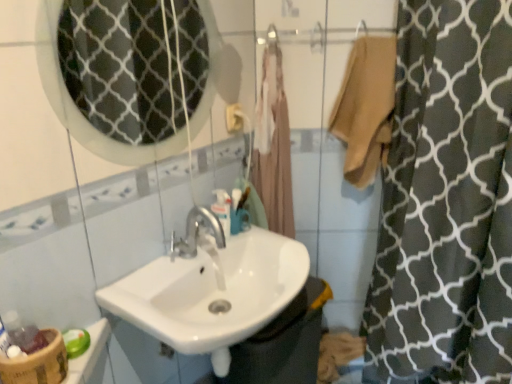
Question: Can you confirm if beige fabric bathrobe at center is smaller than translucent plastic mouthwash at center?

Choices:
 (A) yes
 (B) no

Answer: (B)

Question: From a real-world perspective, is beige fabric bathrobe at center physically below translucent plastic mouthwash at center?

Choices:
 (A) yes
 (B) no

Answer: (B)

Question: Does beige fabric bathrobe at center have a greater width compared to translucent plastic mouthwash at center?

Choices:
 (A) yes
 (B) no

Answer: (A)

Question: From the image's perspective, is beige fabric bathrobe at center on translucent plastic mouthwash at center?

Choices:
 (A) no
 (B) yes

Answer: (B)

Question: Is beige fabric bathrobe at center further to the viewer compared to translucent plastic mouthwash at center?

Choices:
 (A) no
 (B) yes

Answer: (B)

Question: Is beige fabric bathrobe at center closer to the viewer compared to translucent plastic mouthwash at center?

Choices:
 (A) no
 (B) yes

Answer: (A)

Question: Does white glossy sink at center have a lesser height compared to white glossy mirror at upper center?

Choices:
 (A) no
 (B) yes

Answer: (B)

Question: Could white glossy mirror at upper center be considered to be inside white glossy sink at center?

Choices:
 (A) no
 (B) yes

Answer: (A)

Question: Is white glossy sink at center positioned before white glossy mirror at upper center?

Choices:
 (A) yes
 (B) no

Answer: (B)

Question: From a real-world perspective, is white glossy sink at center below white glossy mirror at upper center?

Choices:
 (A) yes
 (B) no

Answer: (A)

Question: Would you say white glossy sink at center is a long distance from white glossy mirror at upper center?

Choices:
 (A) no
 (B) yes

Answer: (A)

Question: From the image's perspective, is white glossy sink at center under white glossy mirror at upper center?

Choices:
 (A) yes
 (B) no

Answer: (A)

Question: Is beige fabric bathrobe at center completely or partially outside of bamboo textured basket at lower left?

Choices:
 (A) yes
 (B) no

Answer: (A)